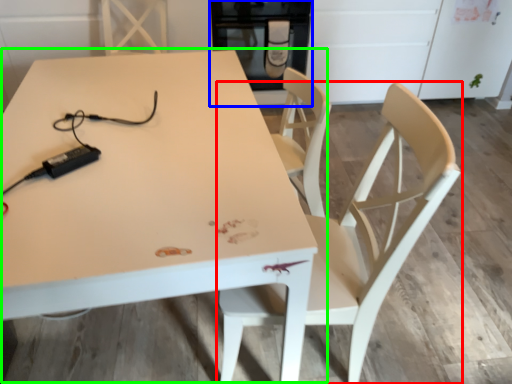
Question: Considering the real-world distances, which object is farthest from chair (highlighted by a red box)? appliance (highlighted by a blue box) or table (highlighted by a green box)?

Choices:
 (A) appliance
 (B) table

Answer: (A)